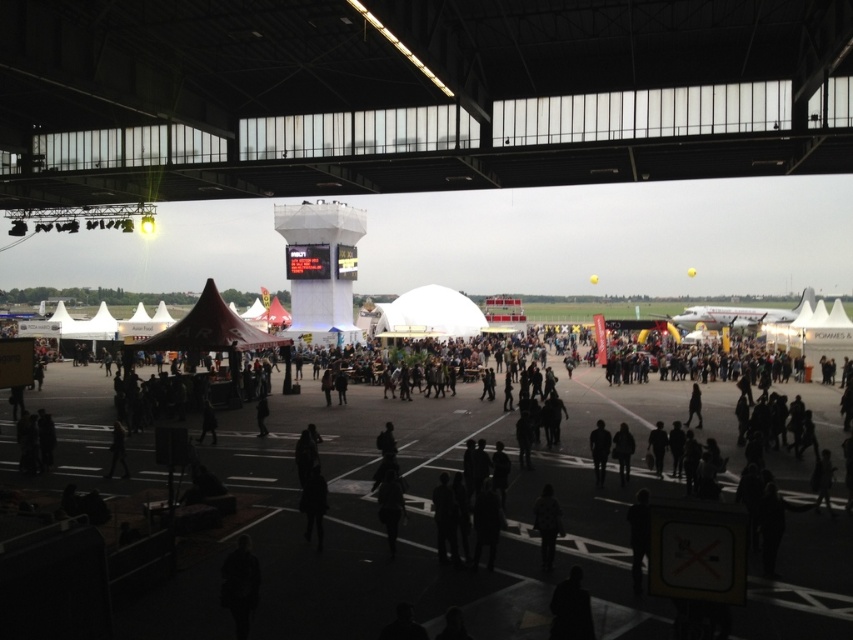
Measure the distance between point (550, 536) and camera.

They are 19.78 meters apart.

At what (x,y) coordinates should I click in order to perform the action: click on dark gray fabric jacket at lower center. Please return your answer as a coordinate pair (x, y). Looking at the image, I should click on (547, 524).

Between point (556, 534) and point (602, 481), which one is positioned behind?

Positioned behind is point (602, 481).

Locate an element on the screen. Image resolution: width=853 pixels, height=640 pixels. dark gray fabric jacket at lower center is located at coordinates (547, 524).

Can you confirm if white plastic control tower at center is positioned below dark gray fabric jacket at lower center?

No, white plastic control tower at center is not below dark gray fabric jacket at lower center.

Measure the distance between point (273, 216) and camera.

110.13 meters

Who is more forward, (343, 296) or (548, 513)?

Point (548, 513)

Identify the location of white plastic control tower at center. The width and height of the screenshot is (853, 640). (321, 268).

Can you confirm if white plastic control tower at center is smaller than dark fabric jacket at center?

No, white plastic control tower at center is not smaller than dark fabric jacket at center.

Between white plastic control tower at center and dark fabric jacket at center, which one is positioned higher?

white plastic control tower at center is higher up.

Between point (305, 205) and point (599, 481), which one is positioned behind?

Positioned behind is point (305, 205).

The image size is (853, 640). In order to click on white plastic control tower at center in this screenshot , I will do `click(321, 268)`.